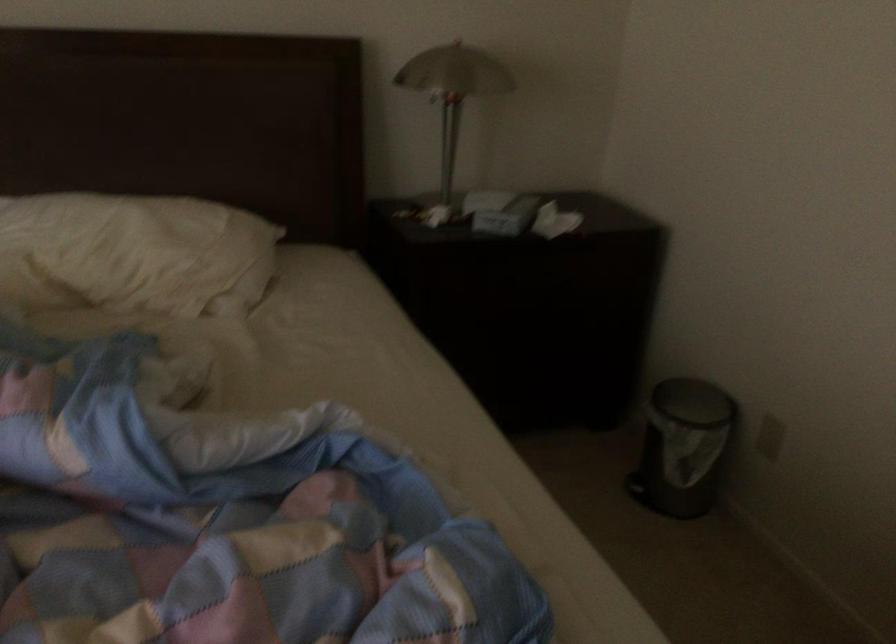
The location [453,91] corresponds to which object?

It corresponds to the silver table lamp in the image.